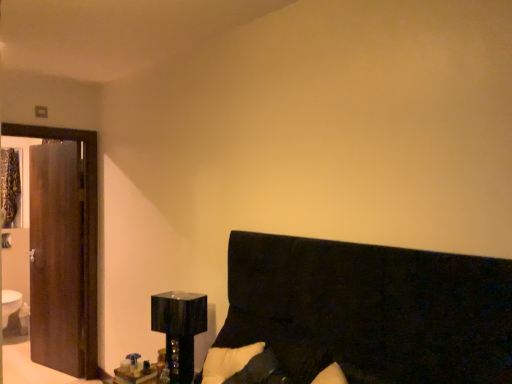
What do you see at coordinates (179, 330) in the screenshot? I see `glossy black cube at lower left` at bounding box center [179, 330].

Measure the distance between dark wood door at left and camera.

The distance of dark wood door at left from camera is 3.50 meters.

The height and width of the screenshot is (384, 512). What do you see at coordinates (135, 376) in the screenshot?
I see `wooden glossy table at lower left` at bounding box center [135, 376].

At what (x,y) coordinates should I click in order to perform the action: click on black fabric headboard at lower right. Please return your answer as a coordinate pair (x, y). Looking at the image, I should click on (360, 315).

At what (x,y) coordinates should I click in order to perform the action: click on glossy black cube at lower left. Please return your answer as a coordinate pair (x, y). This screenshot has width=512, height=384. Looking at the image, I should click on (179, 330).

Does point (437, 272) come behind point (54, 209)?

No, (437, 272) is closer to viewer.

Based on the photo, from the image's perspective, is black fabric headboard at lower right below dark wood door at left?

Yes.

Is black fabric headboard at lower right not close to dark wood door at left?

Yes, black fabric headboard at lower right and dark wood door at left are quite far apart.

From a real-world perspective, does black fabric headboard at lower right stand above dark wood door at left?

Actually, black fabric headboard at lower right is physically below dark wood door at left in the real world.

Considering the sizes of glossy black cube at lower left and wooden glossy table at lower left in the image, is glossy black cube at lower left taller or shorter than wooden glossy table at lower left?

In the image, glossy black cube at lower left appears to be taller than wooden glossy table at lower left.

How different are the orientations of glossy black cube at lower left and wooden glossy table at lower left in degrees?

The angle between the facing direction of glossy black cube at lower left and the facing direction of wooden glossy table at lower left is 3.65 degrees.

Is wooden glossy table at lower left inside glossy black cube at lower left?

That's incorrect, wooden glossy table at lower left is not inside glossy black cube at lower left.

Which object is positioned more to the left, glossy black cube at lower left or wooden glossy table at lower left?

wooden glossy table at lower left.

Is the position of wooden glossy table at lower left more distant than that of dark wood door at left?

No, wooden glossy table at lower left is closer to the viewer.

What's the angular difference between wooden glossy table at lower left and dark wood door at left's facing directions?

The facing directions of wooden glossy table at lower left and dark wood door at left are 7.47 degrees apart.

Can you confirm if wooden glossy table at lower left is bigger than dark wood door at left?

No, wooden glossy table at lower left is not bigger than dark wood door at left.

Could you tell me if wooden glossy table at lower left is turned towards dark wood door at left?

No, wooden glossy table at lower left is not oriented towards dark wood door at left.

Who is shorter, black fabric headboard at lower right or glossy black cube at lower left?

glossy black cube at lower left.

How many degrees apart are the facing directions of black fabric headboard at lower right and glossy black cube at lower left?

The facing directions of black fabric headboard at lower right and glossy black cube at lower left are 12.8 degrees apart.

Would you say black fabric headboard at lower right is inside or outside glossy black cube at lower left?

black fabric headboard at lower right cannot be found inside glossy black cube at lower left.

Based on the photo, which of these two, black fabric headboard at lower right or glossy black cube at lower left, is thinner?

Thinner between the two is glossy black cube at lower left.

Which is more to the left, wooden glossy table at lower left or glossy black cube at lower left?

wooden glossy table at lower left.

Considering the relative sizes of wooden glossy table at lower left and glossy black cube at lower left in the image provided, is wooden glossy table at lower left wider than glossy black cube at lower left?

In fact, wooden glossy table at lower left might be narrower than glossy black cube at lower left.

Is wooden glossy table at lower left inside or outside of glossy black cube at lower left?

wooden glossy table at lower left is spatially situated outside glossy black cube at lower left.

From the image's perspective, who appears lower, wooden glossy table at lower left or glossy black cube at lower left?

wooden glossy table at lower left is shown below in the image.

Considering the points (25, 307) and (76, 286), which point is in front, point (25, 307) or point (76, 286)?

The point (76, 286) is in front.

Can you tell me how much white glossy sink at lower left and dark wood door at left differ in facing direction?

The facing directions of white glossy sink at lower left and dark wood door at left are 72.5 degrees apart.

Is white glossy sink at lower left oriented away from dark wood door at left?

No, white glossy sink at lower left is not facing away from dark wood door at left.

Where is `sink that appears on the left of dark wood door at left`? This screenshot has height=384, width=512. sink that appears on the left of dark wood door at left is located at coordinates (14, 314).

Which object is closer to the camera taking this photo, dark wood door at left or glossy black cube at lower left?

glossy black cube at lower left.

Between dark wood door at left and glossy black cube at lower left, which one has smaller size?

With smaller size is glossy black cube at lower left.

Which of these two, dark wood door at left or glossy black cube at lower left, stands shorter?

Standing shorter between the two is glossy black cube at lower left.

Which object is positioned more to the left, dark wood door at left or glossy black cube at lower left?

Positioned to the left is dark wood door at left.

Identify the location of furniture directly beneath the dark wood door at left (from a real-world perspective). Image resolution: width=512 pixels, height=384 pixels. (360, 315).

The height and width of the screenshot is (384, 512). Identify the location of bedside lamp above the wooden glossy table at lower left (from a real-world perspective). (179, 330).

When comparing their distances from dark wood door at left, does wooden glossy table at lower left or white glossy sink at lower left seem closer?

white glossy sink at lower left lies closer to dark wood door at left than the other object.

Which object lies further to the anchor point glossy black cube at lower left, wooden glossy table at lower left or white glossy sink at lower left?

Based on the image, white glossy sink at lower left appears to be further to glossy black cube at lower left.

Considering their positions, is black fabric headboard at lower right positioned further to wooden glossy table at lower left than dark wood door at left?

dark wood door at left lies further to wooden glossy table at lower left than the other object.

Consider the image. When comparing their distances from wooden glossy table at lower left, does glossy black cube at lower left or dark wood door at left seem further?

Based on the image, dark wood door at left appears to be further to wooden glossy table at lower left.

From the image, which object appears to be nearer to white glossy sink at lower left, black fabric headboard at lower right or glossy black cube at lower left?

Among the two, glossy black cube at lower left is located nearer to white glossy sink at lower left.

Estimate the real-world distances between objects in this image. Which object is further from glossy black cube at lower left, dark wood door at left or black fabric headboard at lower right?

Based on the image, dark wood door at left appears to be further to glossy black cube at lower left.

Estimate the real-world distances between objects in this image. Which object is closer to glossy black cube at lower left, black fabric headboard at lower right or white glossy sink at lower left?

black fabric headboard at lower right.

Looking at the image, which one is located closer to wooden glossy table at lower left, black fabric headboard at lower right or white glossy sink at lower left?

black fabric headboard at lower right.

Identify the location of table between black fabric headboard at lower right and dark wood door at left from front to back. This screenshot has width=512, height=384. (135, 376).

The width and height of the screenshot is (512, 384). Identify the location of bedside lamp positioned between wooden glossy table at lower left and dark wood door at left from near to far. (179, 330).

Find the location of a particular element. The image size is (512, 384). screen door between black fabric headboard at lower right and white glossy sink at lower left along the z-axis is located at coordinates pos(56,257).

This screenshot has height=384, width=512. I want to click on table located between black fabric headboard at lower right and white glossy sink at lower left in the depth direction, so click(x=135, y=376).